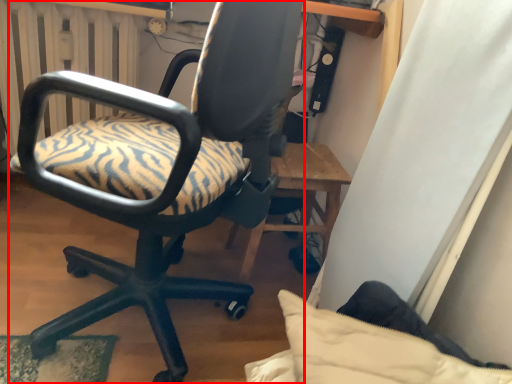
Question: From the image, what is the correct spatial relationship of chair (annotated by the red box) in relation to radiator?

Choices:
 (A) left
 (B) right

Answer: (B)